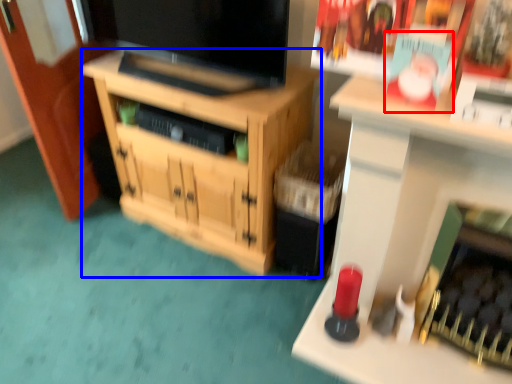
Question: Which object is further to the camera taking this photo, magazine (highlighted by a red box) or cabinetry (highlighted by a blue box)?

Choices:
 (A) magazine
 (B) cabinetry

Answer: (B)